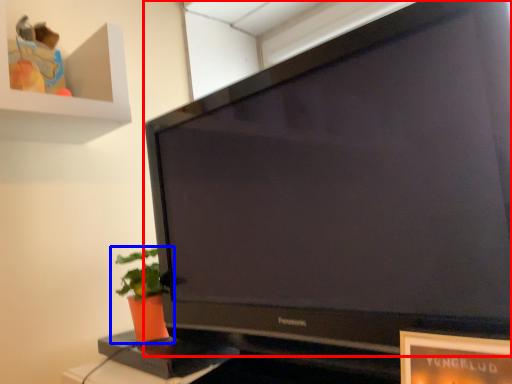
Question: Which object appears farthest to the camera in this image, television (highlighted by a red box) or houseplant (highlighted by a blue box)?

Choices:
 (A) television
 (B) houseplant

Answer: (B)